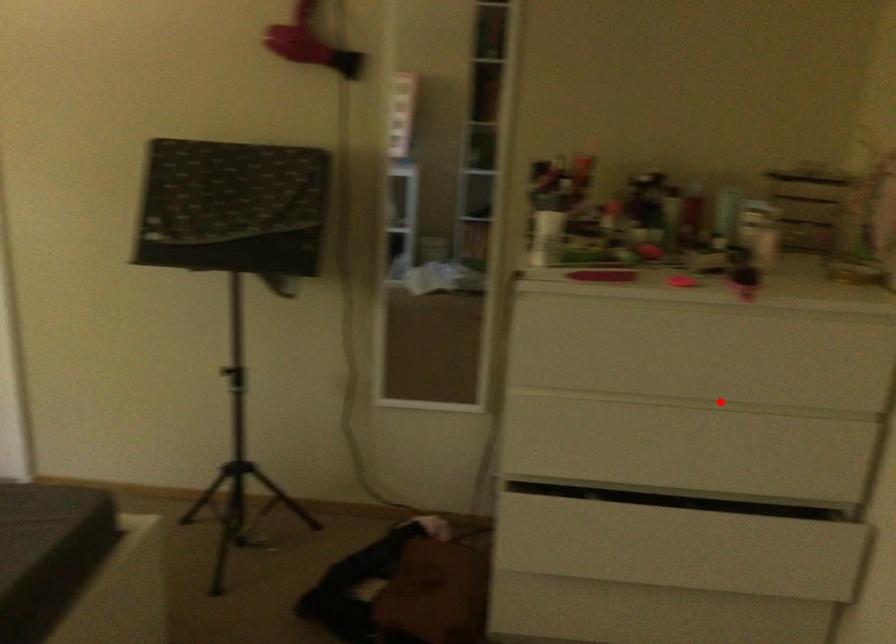
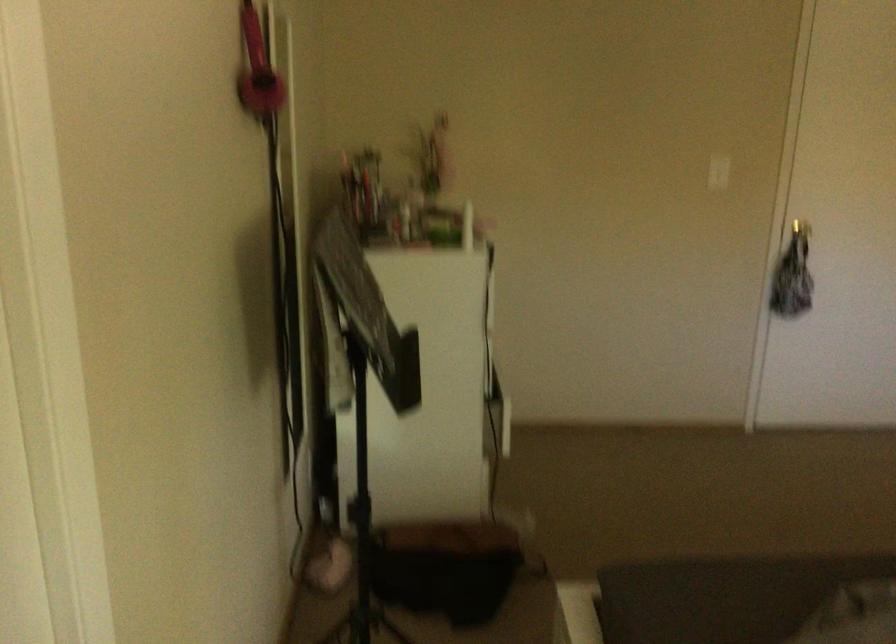
Question: I am providing you with two images of the same scene from different viewpoints. A red point is marked on the first image. Can you still see the location of the red point in image 2?

Choices:
 (A) Yes
 (B) No

Answer: (B)